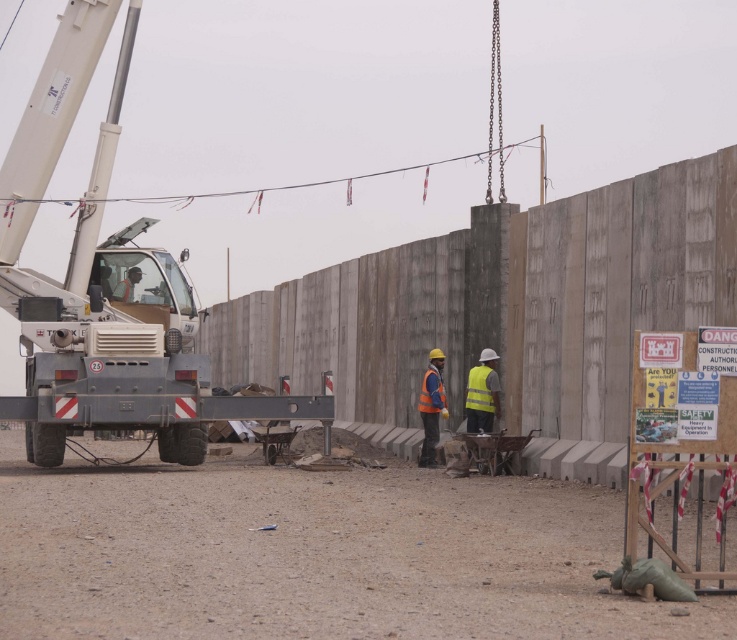
Question: Considering the relative positions of gray metallic crane at left and yellow reflective safety vest at center in the image provided, where is gray metallic crane at left located with respect to yellow reflective safety vest at center?

Choices:
 (A) left
 (B) right

Answer: (A)

Question: Can you confirm if gray metallic crane at left is thinner than yellow reflective safety vest at center?

Choices:
 (A) no
 (B) yes

Answer: (A)

Question: Where is gray metallic crane at left located in relation to yellow reflective safety vest at center in the image?

Choices:
 (A) below
 (B) above

Answer: (B)

Question: Which object is closer to the camera taking this photo?

Choices:
 (A) gray metallic crane at left
 (B) orange reflective safety vest at center

Answer: (A)

Question: Which of the following is the farthest from the observer?

Choices:
 (A) orange reflective safety vest at center
 (B) gray metallic crane at left

Answer: (A)

Question: Estimate the real-world distances between objects in this image. Which object is farther from the gray metallic crane at left?

Choices:
 (A) reflective orange vest at center
 (B) orange reflective safety vest at center

Answer: (B)